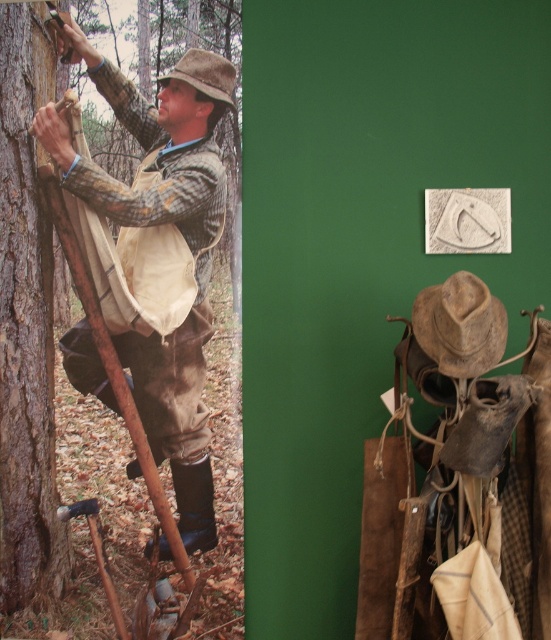
You are an observer standing in front of the image. You notice the smooth brown bark at left and the brown leather cowboy hat at center. Which object takes up more space in the image?

The smooth brown bark at left is larger in size than the brown leather cowboy hat at center, so it takes up more space in the image.

You are an observer standing in front of the image. You see the camouflage fabric shirt at left and the brown leather cowboy hat at center. Which object is positioned further to the left?

The camouflage fabric shirt at left is positioned further to the left than the brown leather cowboy hat at center.